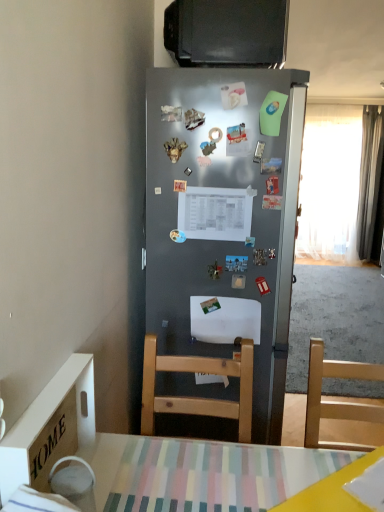
Question: From a real-world perspective, is white sheer curtain at right, acting as the first curtain starting from the left, located higher than black glossy television at upper center?

Choices:
 (A) yes
 (B) no

Answer: (B)

Question: Is white sheer curtain at right, acting as the first curtain starting from the left, next to black glossy television at upper center?

Choices:
 (A) yes
 (B) no

Answer: (B)

Question: From a real-world perspective, is white sheer curtain at right, acting as the first curtain starting from the left, under black glossy television at upper center?

Choices:
 (A) no
 (B) yes

Answer: (B)

Question: From the image's perspective, is white sheer curtain at right, positioned as the second curtain in right-to-left order, over black glossy television at upper center?

Choices:
 (A) yes
 (B) no

Answer: (A)

Question: Can you confirm if white sheer curtain at right, acting as the first curtain starting from the left, is taller than black glossy television at upper center?

Choices:
 (A) no
 (B) yes

Answer: (B)

Question: Is white sheer curtain at right, acting as the first curtain starting from the left, closer to the viewer compared to black glossy television at upper center?

Choices:
 (A) no
 (B) yes

Answer: (A)

Question: Does metallic rectangular magnet at center, which is counted as the 4th magnet, starting from the bottom, come behind metallic silver magnet at upper center, acting as the tenth magnet starting from the bottom?

Choices:
 (A) yes
 (B) no

Answer: (A)

Question: Can you confirm if metallic rectangular magnet at center, the eighth magnet from the top, is thinner than metallic silver magnet at upper center, acting as the tenth magnet starting from the bottom?

Choices:
 (A) no
 (B) yes

Answer: (B)

Question: Could metallic silver magnet at upper center, acting as the tenth magnet starting from the bottom, be considered to be inside metallic rectangular magnet at center, the eighth magnet from the top?

Choices:
 (A) no
 (B) yes

Answer: (A)

Question: Is metallic rectangular magnet at center, the eighth magnet from the top, facing away from metallic silver magnet at upper center, the 2th magnet from the top?

Choices:
 (A) yes
 (B) no

Answer: (B)

Question: Could you tell me if metallic rectangular magnet at center, which is counted as the 4th magnet, starting from the bottom, is facing metallic silver magnet at upper center, the 2th magnet from the top?

Choices:
 (A) yes
 (B) no

Answer: (B)

Question: From a real-world perspective, is metallic rectangular magnet at center, the eighth magnet from the top, positioned under metallic silver magnet at upper center, the 2th magnet from the top, based on gravity?

Choices:
 (A) yes
 (B) no

Answer: (A)

Question: Does metallic silver magnet at center, positioned as the eighth magnet in bottom-to-top order, turn towards metallic rectangular magnet at center, the eighth magnet from the top?

Choices:
 (A) no
 (B) yes

Answer: (A)